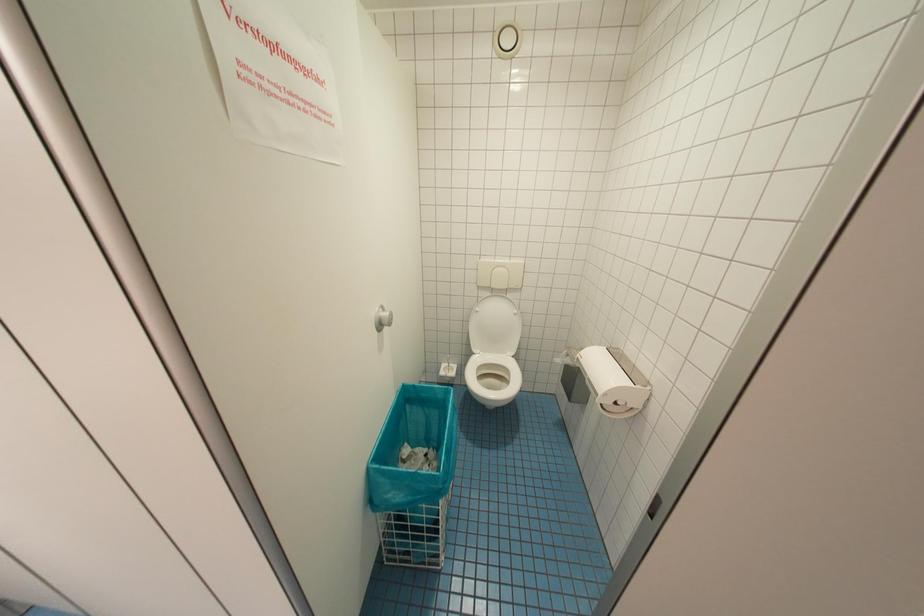
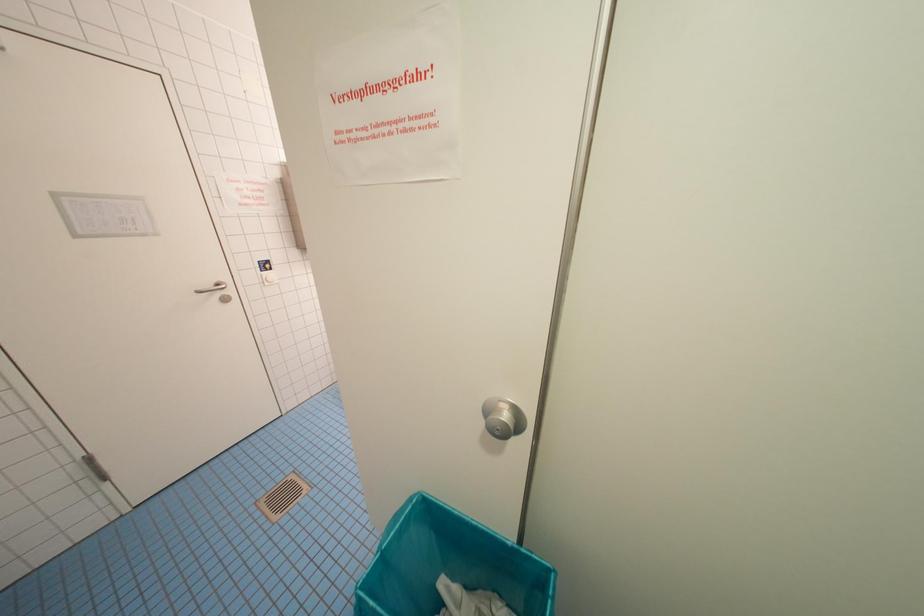
Based on the continuous images, in which direction is the camera rotating?

The rotation direction of the camera is left-down.